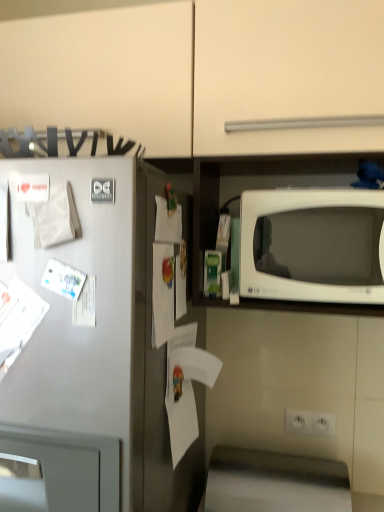
Question: Considering their positions, is white plastic electric outlet at lower center located in front of or behind white matte paper at left, which ranks as the 2th paper in top-to-bottom order?

Choices:
 (A) behind
 (B) front

Answer: (A)

Question: Is white plastic electric outlet at lower center to the left or to the right of white matte paper at left, which is the 3th paper from right to left, in the image?

Choices:
 (A) left
 (B) right

Answer: (B)

Question: Which object is the closest to the white glossy paper at left, which appears as the third paper when viewed from the top?

Choices:
 (A) white paper at center, which ranks as the fourth paper in left-to-right order
 (B) white matte paper at center, the 2th paper viewed from the right
 (C) white matte paper at left, which is the 3th paper from right to left
 (D) white plastic electric outlet at lower center
 (E) satin silver refrigerator at left

Answer: (C)

Question: Considering the real-world distances, which object is closest to the white glossy microwave at right?

Choices:
 (A) satin silver refrigerator at left
 (B) white paper at center, the 4th paper when ordered from top to bottom
 (C) white plastic electric outlet at lower center
 (D) white matte paper at left, the second paper viewed from the left
 (E) white glossy paper at left, arranged as the second paper when ordered from the bottom

Answer: (B)